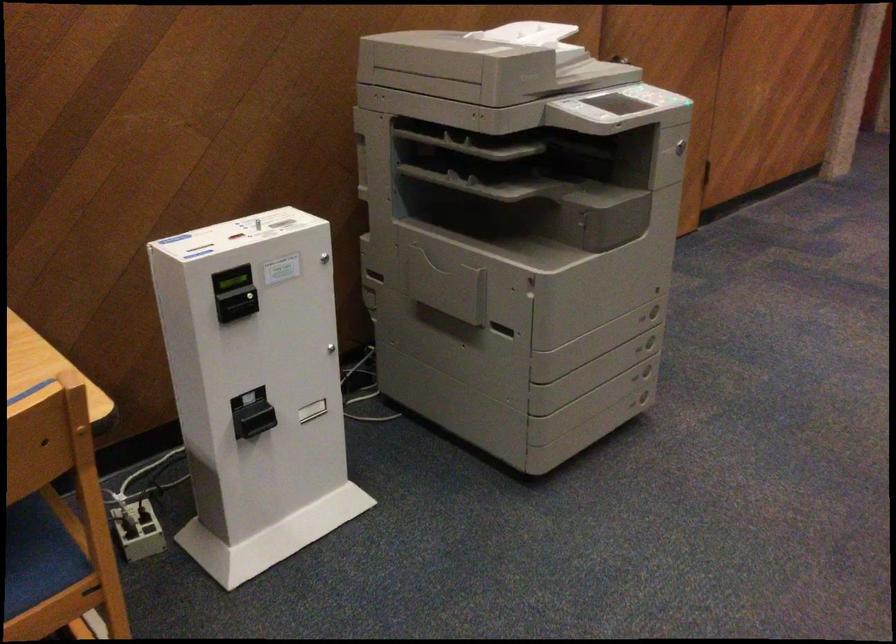
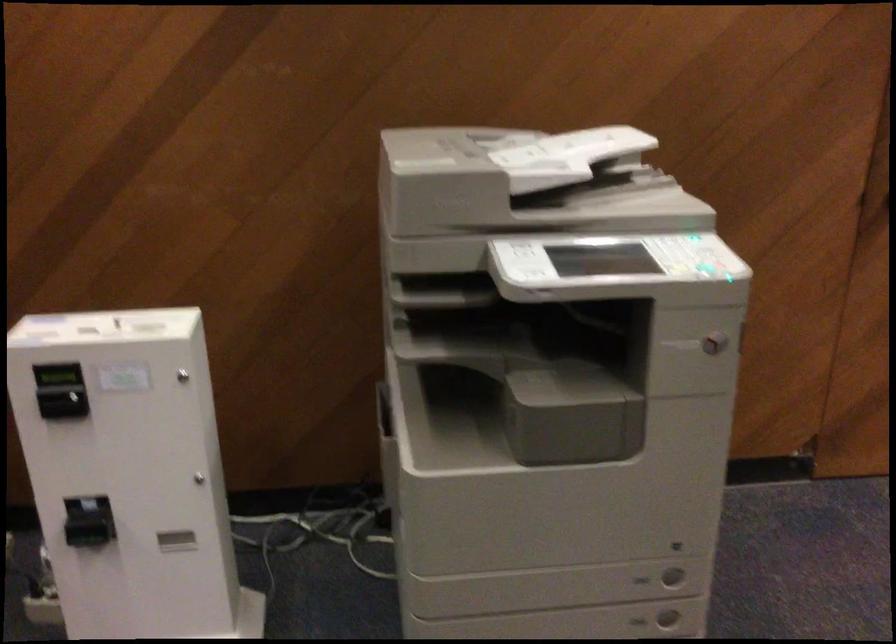
Where in the second image is the point corresponding to (x=678, y=146) from the first image?

(713, 343)